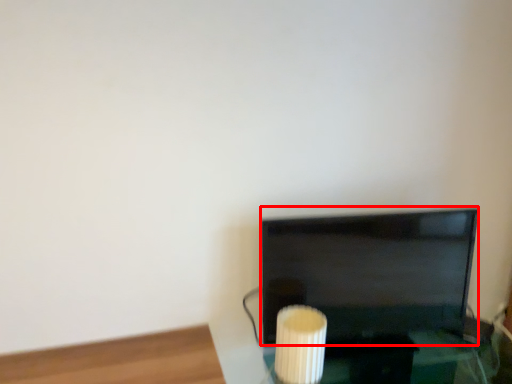
Question: From the image's perspective, what is the correct spatial positioning of television (annotated by the red box) in reference to candle holder?

Choices:
 (A) above
 (B) below

Answer: (A)